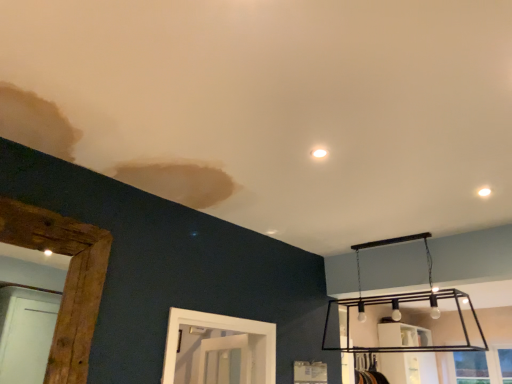
At what (x,y) coordinates should I click in order to perform the action: click on smooth plaster ceiling at upper center. Please return your answer as a coordinate pair (x, y). The width and height of the screenshot is (512, 384). Looking at the image, I should click on (276, 108).

Consider the image. What is the approximate height of smooth plaster ceiling at upper center?

smooth plaster ceiling at upper center is 2.80 inches tall.

Describe the element at coordinates (276, 108) in the screenshot. I see `smooth plaster ceiling at upper center` at that location.

Identify the location of smooth plaster ceiling at upper center. The width and height of the screenshot is (512, 384). (276, 108).